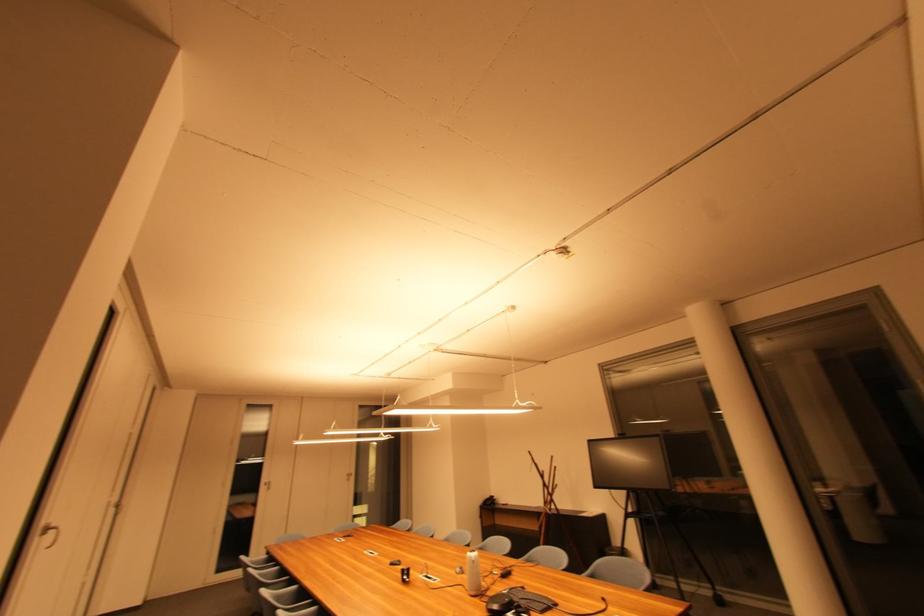
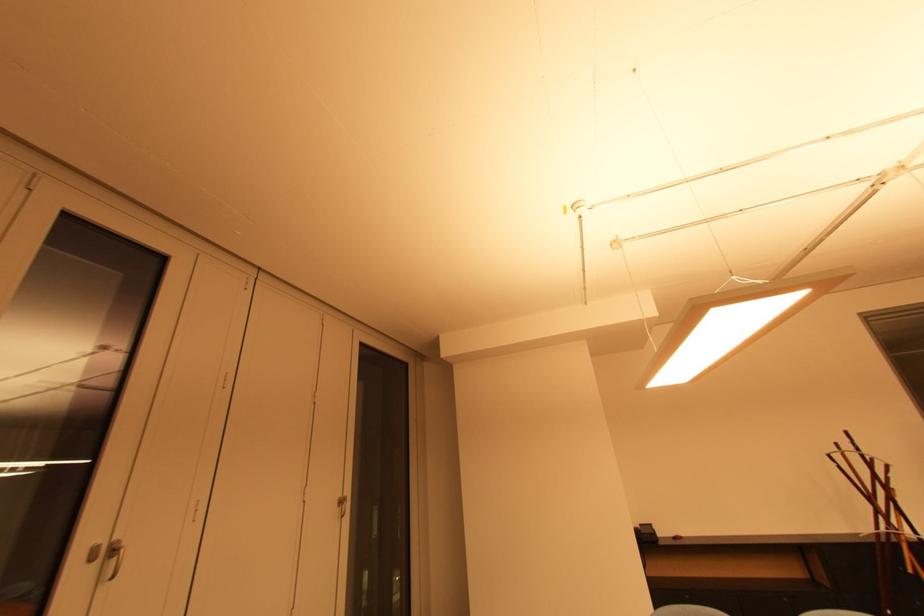
Where in the second image is the point corresponding to point 354,477 from the first image?

(346, 504)